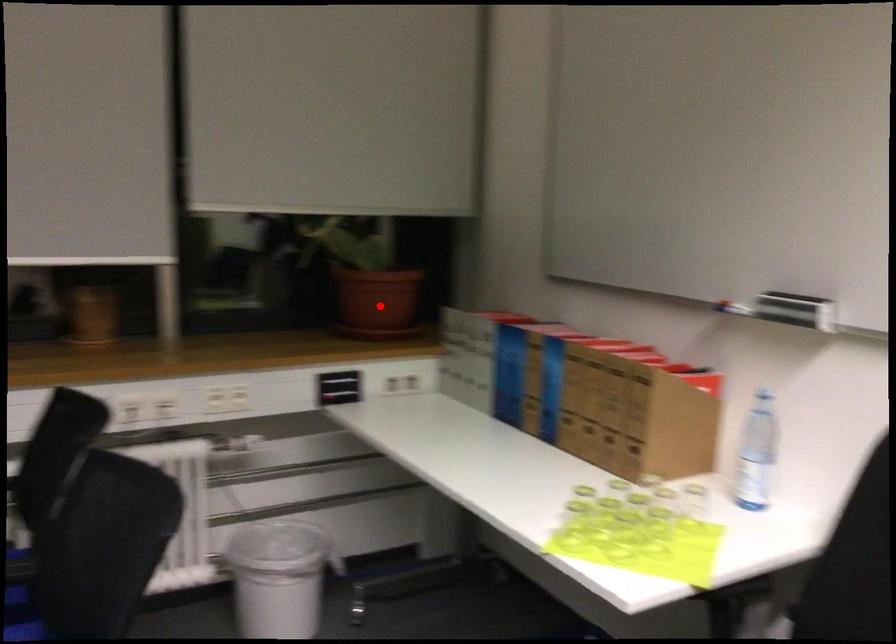
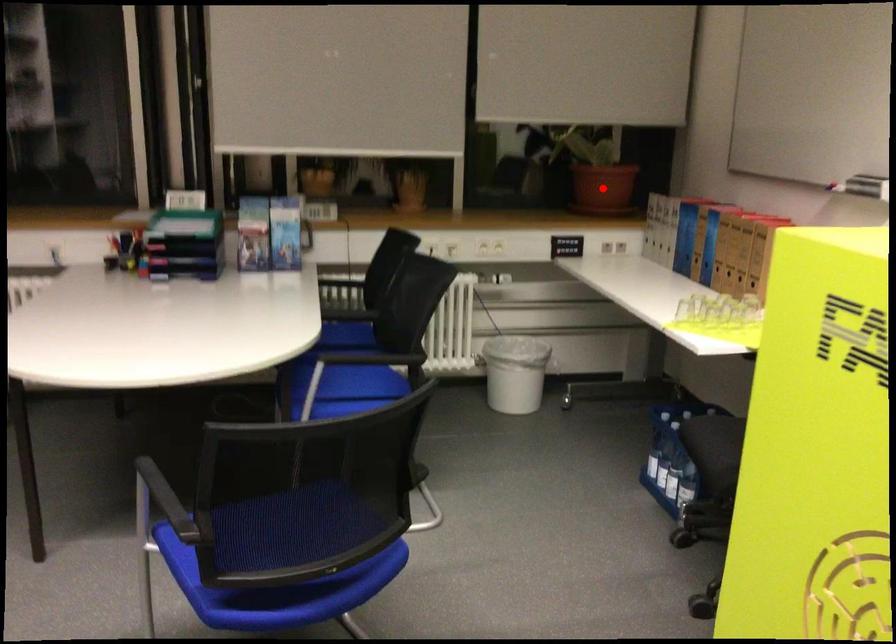
I am providing you with two images of the same scene from different viewpoints. A red point is marked on the first image and another point is marked on the second image. Are the points marked in image1 and image2 representing the same 3D position?

Yes